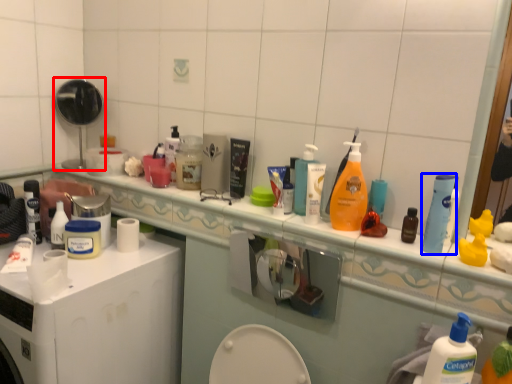
Question: Among these objects, which one is farthest to the camera, mirror (highlighted by a red box) or mouthwash (highlighted by a blue box)?

Choices:
 (A) mirror
 (B) mouthwash

Answer: (A)